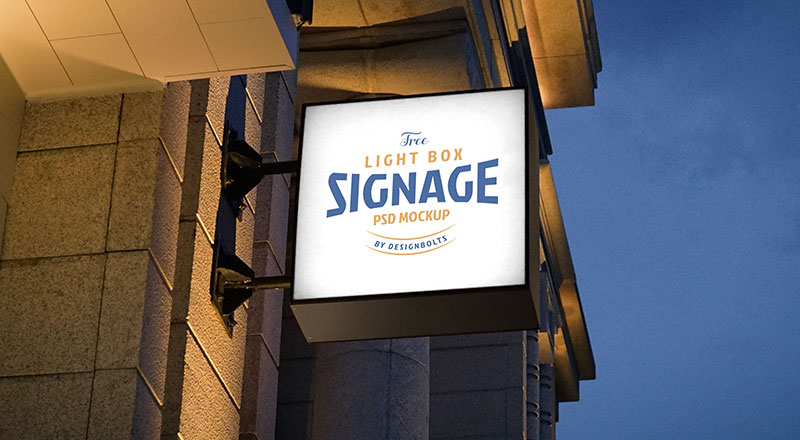
I want to click on wall, so click(221, 347).